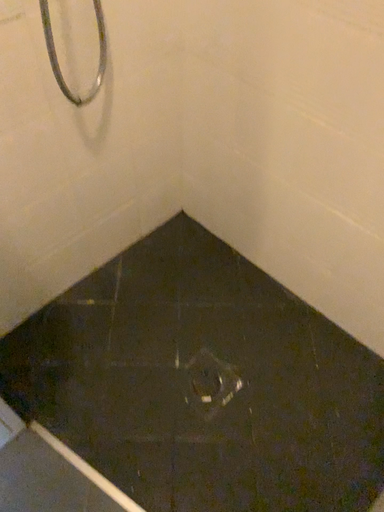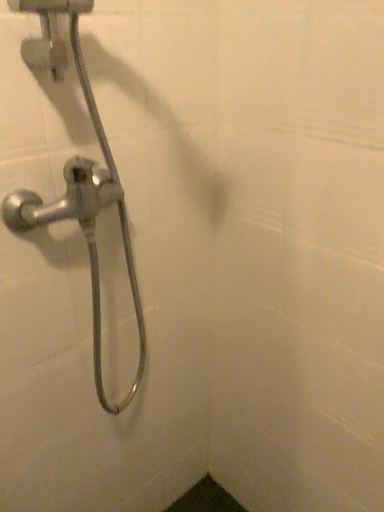
Question: Which way did the camera rotate in the video?

Choices:
 (A) rotated upward
 (B) rotated downward

Answer: (A)